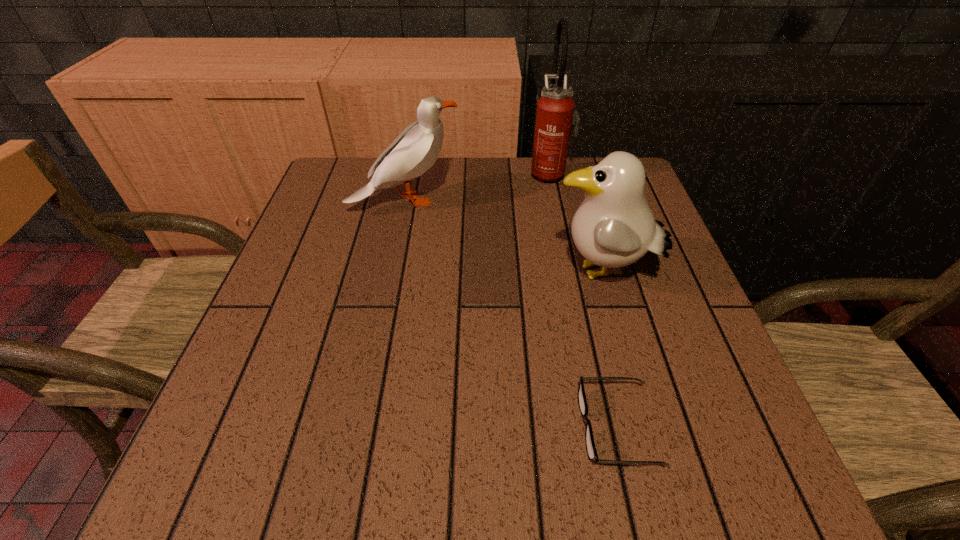
At what (x,y) coordinates should I click in order to perform the action: click on the second closest object to the shortest object. Please return your answer as a coordinate pair (x, y). Image resolution: width=960 pixels, height=540 pixels. Looking at the image, I should click on (415, 150).